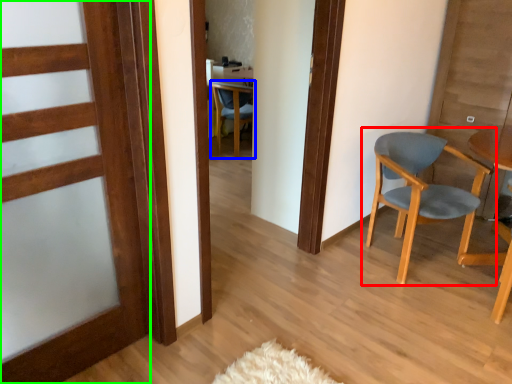
Question: Estimate the real-world distances between objects in this image. Which object is farther from chair (highlighted by a red box), chair (highlighted by a blue box) or door (highlighted by a green box)?

Choices:
 (A) chair
 (B) door

Answer: (A)